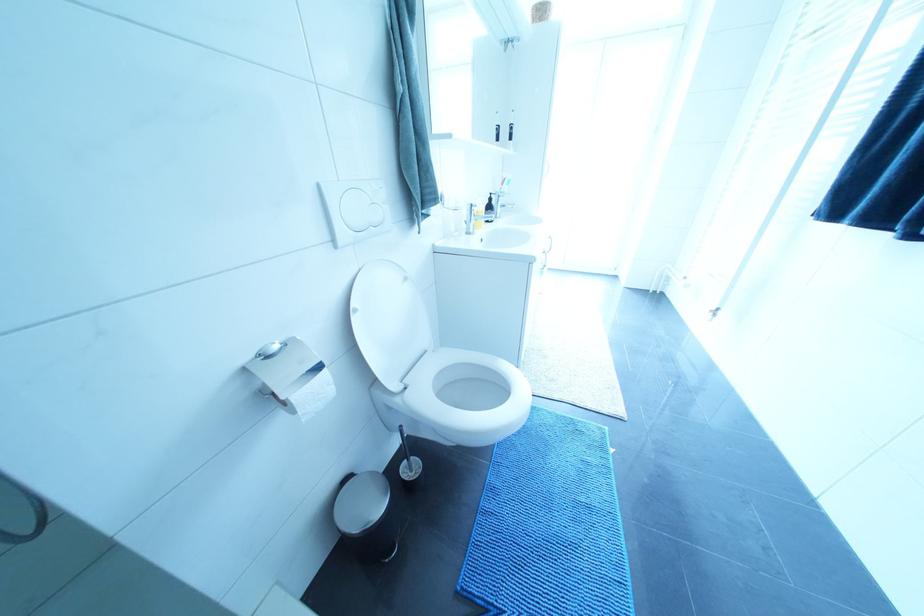
Locate an element on the screen. The width and height of the screenshot is (924, 616). trash can pedal is located at coordinates (367, 516).